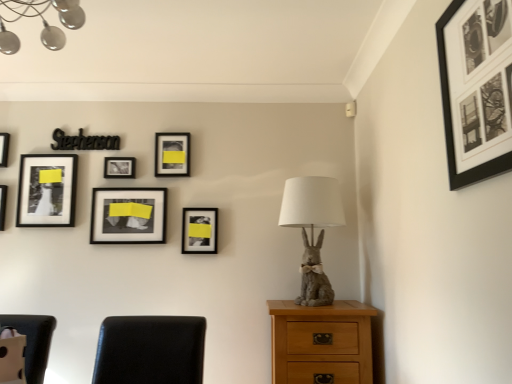
Question: Considering the relative positions of matte black picture frame at upper center, the 7th picture frame from the front, and gray fabric rabbit at center in the image provided, is matte black picture frame at upper center, the 7th picture frame from the front, to the left or to the right of gray fabric rabbit at center?

Choices:
 (A) left
 (B) right

Answer: (A)

Question: Considering the positions of point (177, 157) and point (312, 276), is point (177, 157) closer or farther from the camera than point (312, 276)?

Choices:
 (A) closer
 (B) farther

Answer: (B)

Question: Estimate the real-world distances between objects in this image. Which object is closer to the matte black picture frame at left, the 2th picture frame from the left?

Choices:
 (A) matte black picture frame at center, which is counted as the 4th picture frame, starting from the right
 (B) matte black picture frame at upper center, the 3th picture frame in the right-to-left sequence
 (C) light oak wooden chest of drawers at lower right
 (D) matte black picture frame at upper left, which is the 6th picture frame from front to back
 (E) matte black frame at upper left, the sixth picture frame in the right-to-left sequence

Answer: (E)

Question: Which is farther from the gray fabric rabbit at center?

Choices:
 (A) black matte picture frame at upper right, which ranks as the first picture frame in right-to-left order
 (B) matte black picture frame at upper left, the fifth picture frame viewed from the right
 (C) light oak wooden chest of drawers at lower right
 (D) matte black picture frame at center, which is counted as the 4th picture frame, starting from the right
 (E) matte black picture frame at upper center, the 7th picture frame from the front

Answer: (B)